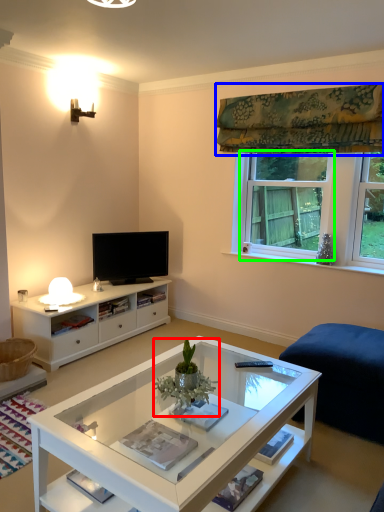
Question: Which object is the farthest from houseplant (highlighted by a red box)? Choose among these: curtain (highlighted by a blue box) or window (highlighted by a green box).

Choices:
 (A) curtain
 (B) window

Answer: (A)